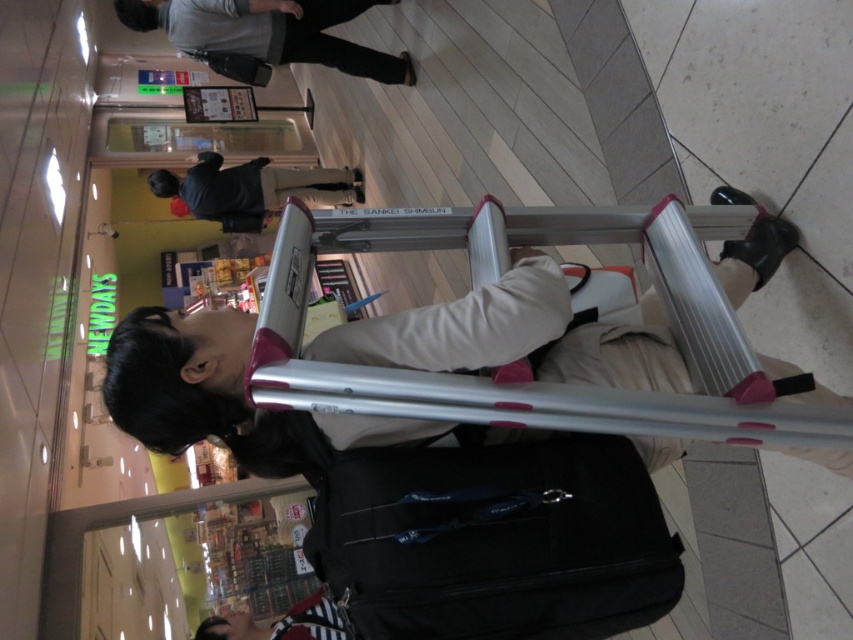
Can you confirm if black fabric suitcase at lower center is shorter than gray fabric jacket at upper center?

Indeed, black fabric suitcase at lower center has a lesser height compared to gray fabric jacket at upper center.

Is the position of black fabric suitcase at lower center less distant than that of gray fabric jacket at upper center?

Yes, black fabric suitcase at lower center is in front of gray fabric jacket at upper center.

Does point (505, 632) come farther from viewer compared to point (253, 22)?

No.

Find the location of a particular element. Image resolution: width=853 pixels, height=640 pixels. black fabric suitcase at lower center is located at coordinates (494, 540).

Can you confirm if gray fabric jacket at upper center is positioned to the right of black matte jacket at upper center?

Correct, you'll find gray fabric jacket at upper center to the right of black matte jacket at upper center.

Which is below, gray fabric jacket at upper center or black matte jacket at upper center?

black matte jacket at upper center is lower down.

This screenshot has height=640, width=853. Describe the element at coordinates (268, 33) in the screenshot. I see `gray fabric jacket at upper center` at that location.

At what (x,y) coordinates should I click in order to perform the action: click on gray fabric jacket at upper center. Please return your answer as a coordinate pair (x, y). Looking at the image, I should click on (268, 33).

How distant is silver metallic crutches at center from black matte jacket at upper center?

The distance of silver metallic crutches at center from black matte jacket at upper center is 3.68 meters.

Between silver metallic crutches at center and black matte jacket at upper center, which one appears on the right side from the viewer's perspective?

silver metallic crutches at center is more to the right.

Is point (514, 253) farther from viewer compared to point (241, 182)?

No, (514, 253) is in front of (241, 182).

Locate an element on the screen. This screenshot has width=853, height=640. silver metallic crutches at center is located at coordinates (515, 336).